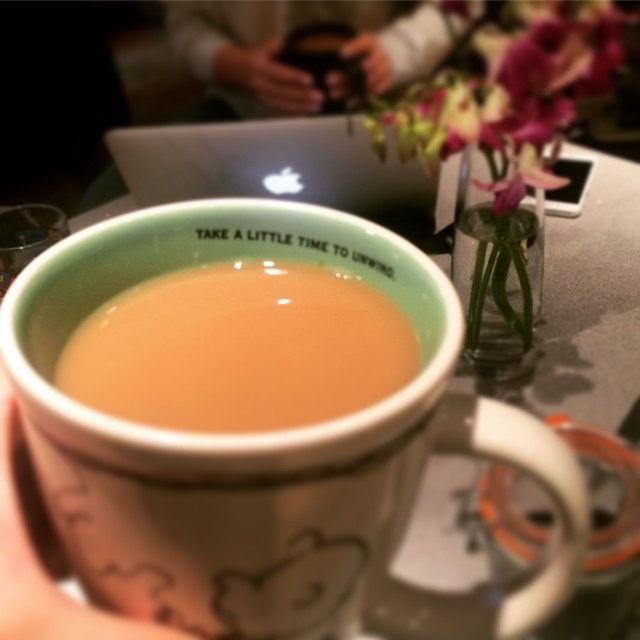
This screenshot has width=640, height=640. What do you see at coordinates (240, 349) in the screenshot? I see `brown matte cup at center` at bounding box center [240, 349].

Is brown matte cup at center bigger than white matte cup at center?

Indeed, brown matte cup at center has a larger size compared to white matte cup at center.

You are a GUI agent. You are given a task and a screenshot of the screen. Output one action in this format:
    pyautogui.click(x=<x>, y=<y>)
    Task: Click on the brown matte cup at center
    This screenshot has width=640, height=640.
    Given the screenshot: What is the action you would take?
    pyautogui.click(x=240, y=349)

Between purple silk flower at upper right and white matte cup at center, which one is positioned higher?

purple silk flower at upper right is higher up.

Is purple silk flower at upper right taller than white matte cup at center?

Yes, purple silk flower at upper right is taller than white matte cup at center.

The width and height of the screenshot is (640, 640). I want to click on purple silk flower at upper right, so click(x=506, y=88).

Who is higher up, white ceramic mug at center or matte black phone at upper center?

matte black phone at upper center is above.

You are a GUI agent. You are given a task and a screenshot of the screen. Output one action in this format:
    pyautogui.click(x=<x>, y=<y>)
    Task: Click on the white ceramic mug at center
    The height and width of the screenshot is (640, 640).
    Given the screenshot: What is the action you would take?
    pyautogui.click(x=269, y=451)

Between point (145, 618) and point (253, 58), which one is positioned in front?

Positioned in front is point (145, 618).

Locate an element on the screen. white ceramic mug at center is located at coordinates (269, 451).